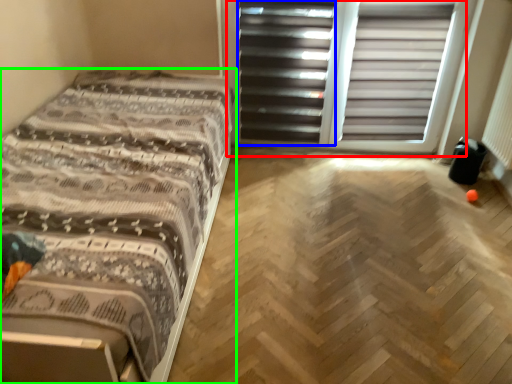
Question: Estimate the real-world distances between objects in this image. Which object is closer to screen door (highlighted by a red box), screen door (highlighted by a blue box) or bed (highlighted by a green box)?

Choices:
 (A) screen door
 (B) bed

Answer: (A)